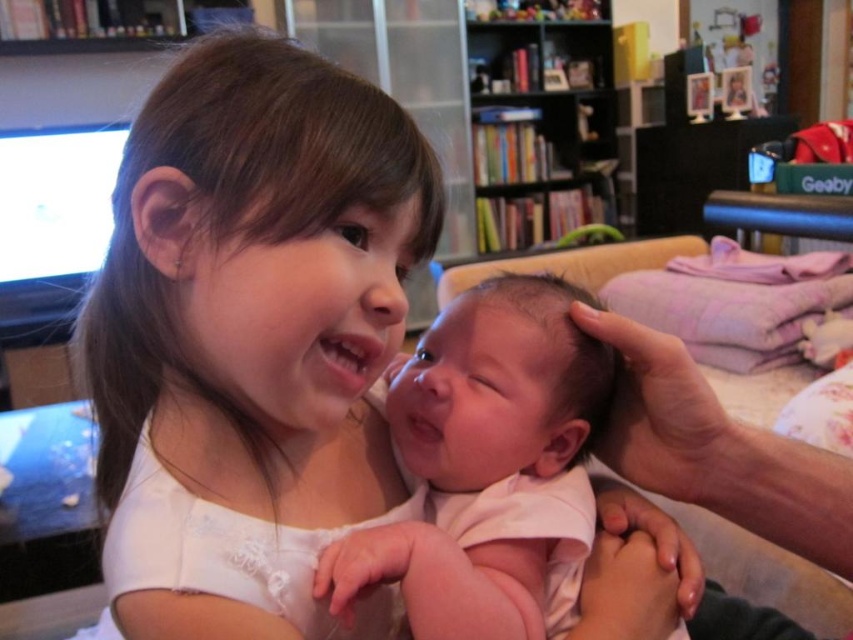
Does smooth white shirt at center appear under wooden bookshelf at upper center?

Indeed, smooth white shirt at center is positioned under wooden bookshelf at upper center.

Is point (157, 612) positioned behind point (589, 193)?

No.

Which is behind, point (328, 269) or point (523, 225)?

Positioned behind is point (523, 225).

Where is `smooth white shirt at center`? smooth white shirt at center is located at coordinates (251, 339).

Consider the image. Does smooth white shirt at center appear over pink soft fabric baby at center?

Yes.

Does smooth white shirt at center have a smaller size compared to pink soft fabric baby at center?

No.

Between point (247, 625) and point (352, 584), which one is positioned behind?

The point (247, 625) is behind.

Where is `smooth white shirt at center`? The width and height of the screenshot is (853, 640). smooth white shirt at center is located at coordinates (251, 339).

Is point (473, 456) in front of point (592, 38)?

Yes, it is in front of point (592, 38).

Does pink soft fabric baby at center have a lesser height compared to wooden bookshelf at upper center?

Correct, pink soft fabric baby at center is not as tall as wooden bookshelf at upper center.

Describe the element at coordinates (500, 388) in the screenshot. I see `pink soft fabric baby at center` at that location.

Find the location of a particular element. Image resolution: width=853 pixels, height=640 pixels. pink soft fabric baby at center is located at coordinates (500, 388).